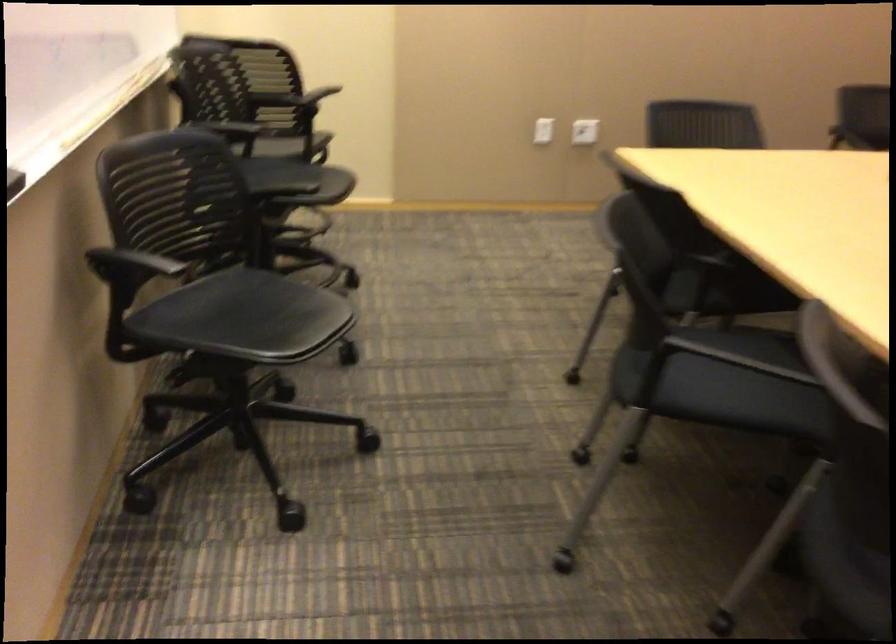
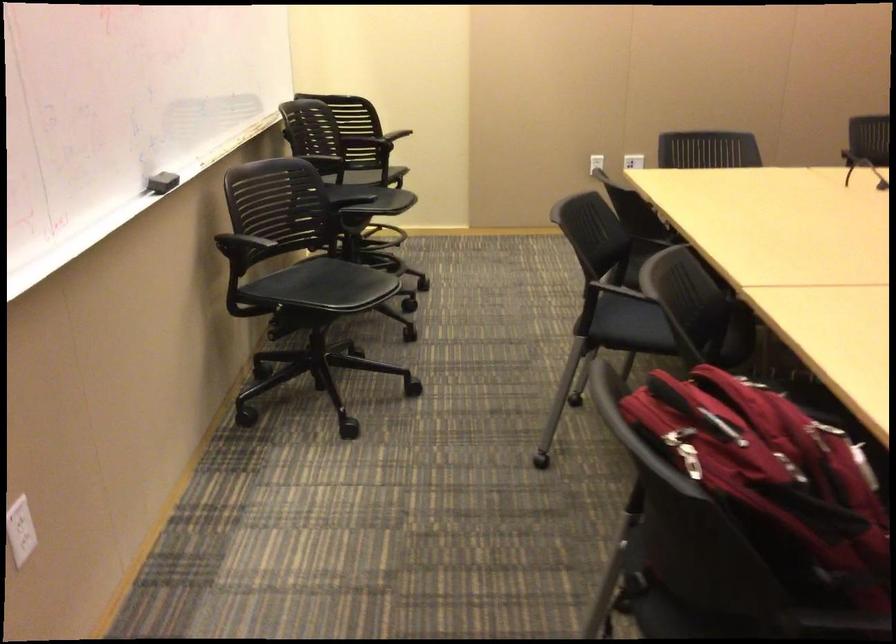
Where in the second image is the point corresponding to (x=668, y=372) from the first image?

(629, 324)